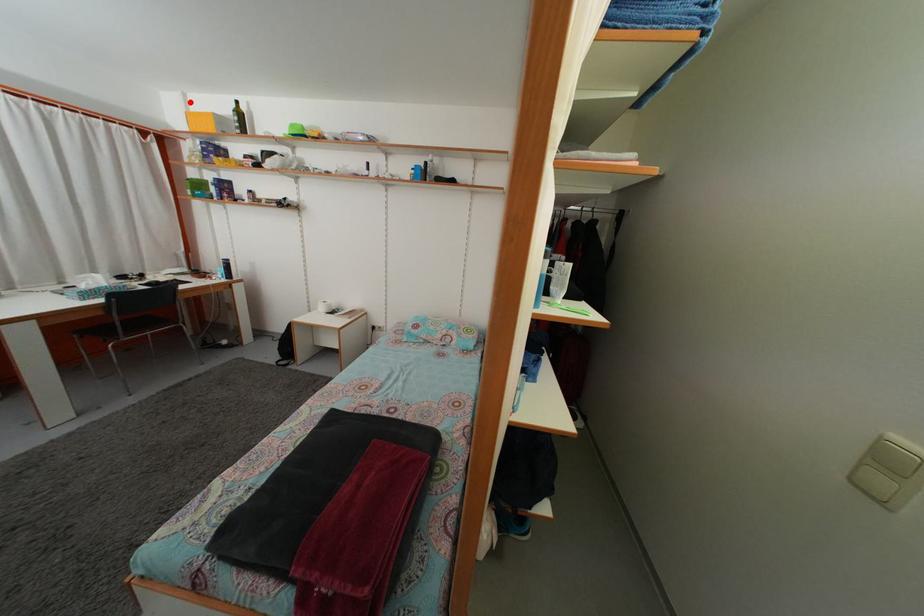
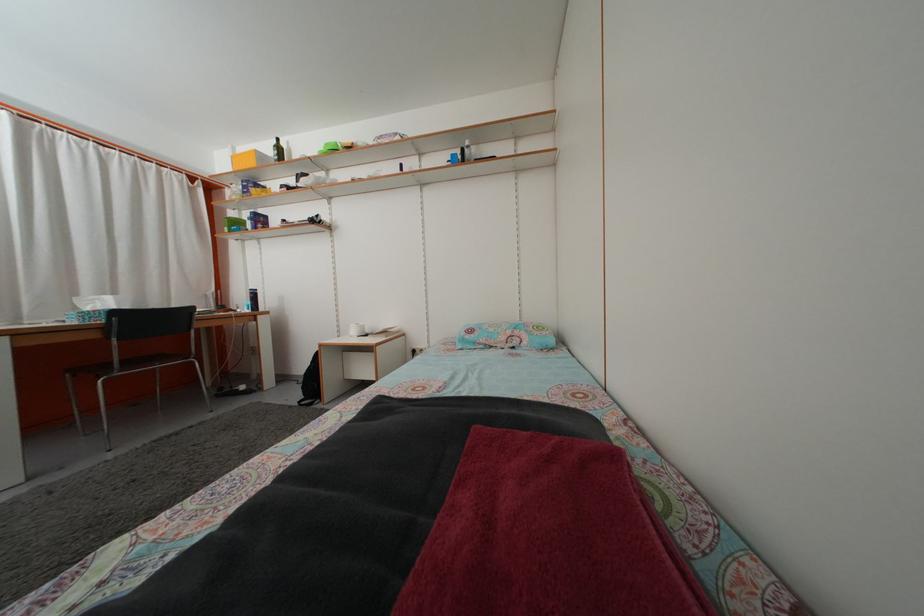
The point at the highlighted location is marked in the first image. Where is the corresponding point in the second image?

(239, 156)